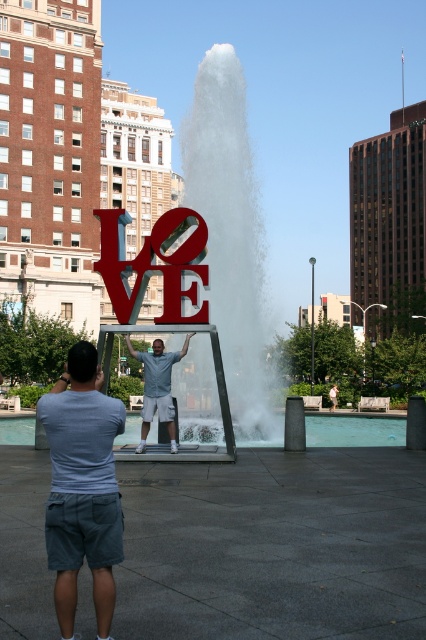
You are standing in the plaza and want to take a photo of the two points mentioned. Which point is closer to you, point (x=55, y=532) or point (x=166, y=416)?

Point (x=55, y=532) is closer to the viewer than point (x=166, y=416).

You are a photographer trying to capture the LOVE sculpture in the background. You notice two people in the foreground wearing gray cotton shorts at lower left and light blue shirt at center. Which clothing item is blocking your view of the sculpture more?

The gray cotton shorts at lower left is positioned over light blue shirt at center, meaning it is closer to the camera and thus blocking more of the view of the LOVE sculpture.